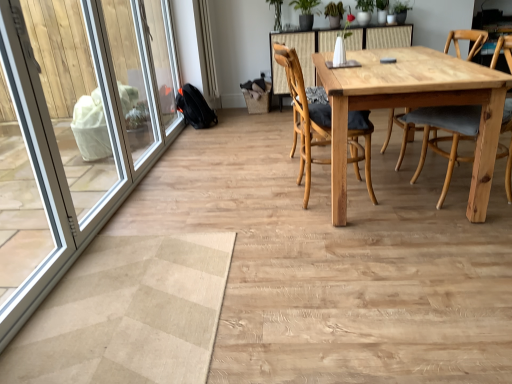
You are a GUI agent. You are given a task and a screenshot of the screen. Output one action in this format:
    pyautogui.click(x=<x>, y=<y>)
    Task: Click on the empty space that is in between white plastic screen door at left and wooden chair at center, the 2th chair positioned from the right
    The height and width of the screenshot is (384, 512).
    Given the screenshot: What is the action you would take?
    pyautogui.click(x=203, y=205)